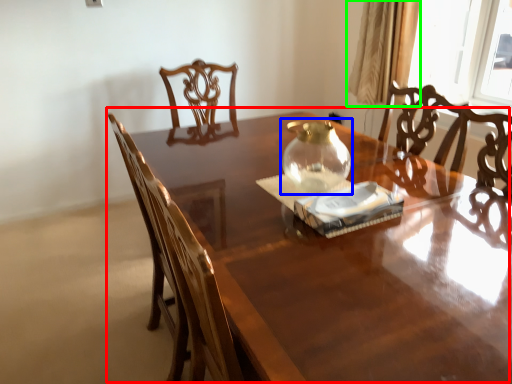
Question: Which object is the farthest from table (highlighted by a red box)? Choose among these: glass vase (highlighted by a blue box) or curtain (highlighted by a green box).

Choices:
 (A) glass vase
 (B) curtain

Answer: (B)